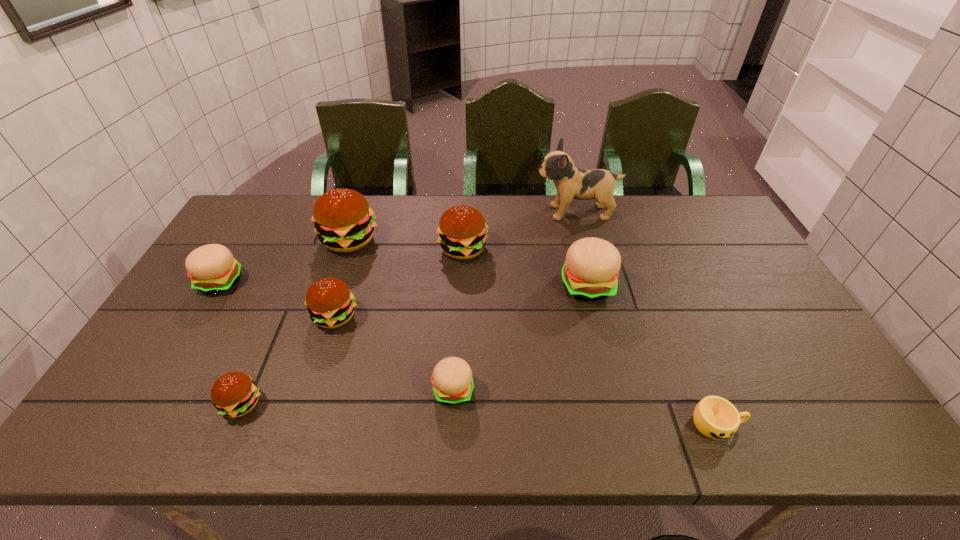
You are a GUI agent. You are given a task and a screenshot of the screen. Output one action in this format:
    pyautogui.click(x=<x>, y=<y>)
    Task: Click on the second beige hamburger from right to left
    
    Given the screenshot: What is the action you would take?
    pyautogui.click(x=452, y=381)

The image size is (960, 540). Identify the location of the nearest beige hamburger. (452, 381).

Find the location of a particular element. This screenshot has width=960, height=540. cup is located at coordinates (715, 417).

Locate an element on the screen. The height and width of the screenshot is (540, 960). the shortest object is located at coordinates pyautogui.click(x=715, y=417).

Identify the location of vacant region located 0.290m at the face of the tallest object. (453, 213).

Where is `vacant space located 0.150m at the face of the tallest object`? The width and height of the screenshot is (960, 540). vacant space located 0.150m at the face of the tallest object is located at coordinates (492, 213).

Locate an element on the screen. This screenshot has height=540, width=960. vacant position located 0.390m at the face of the tallest object is located at coordinates (425, 213).

Find the location of a particular element. The image size is (960, 540). free space located on the left of the tallest hamburger is located at coordinates [x=274, y=240].

Where is `vacant space located on the front of the second biggest brown hamburger`? vacant space located on the front of the second biggest brown hamburger is located at coordinates (458, 356).

You are a GUI agent. You are given a task and a screenshot of the screen. Output one action in this format:
    pyautogui.click(x=<x>, y=<y>)
    Task: Click on the vacant space located on the back of the biggest beige hamburger
    This screenshot has width=960, height=540.
    Given the screenshot: What is the action you would take?
    pos(571,221)